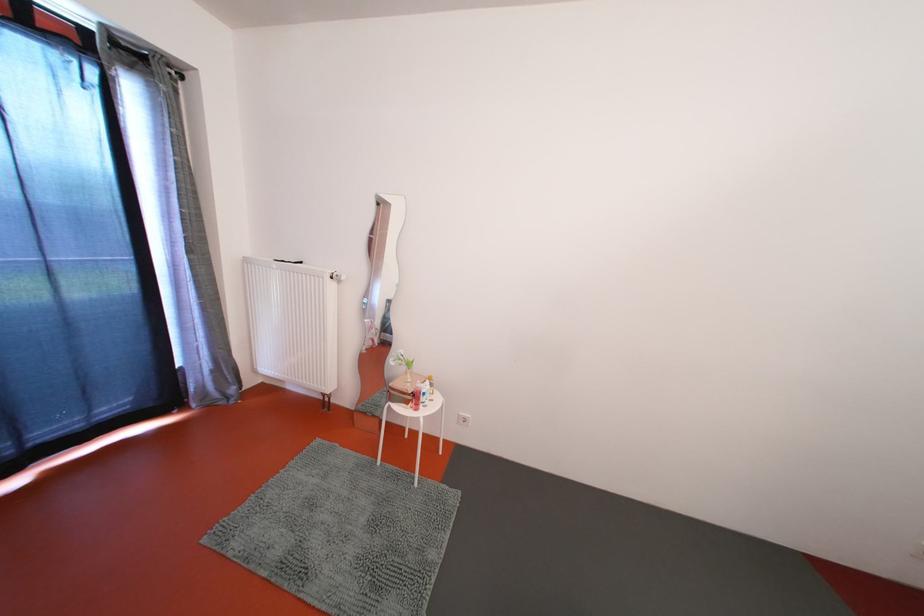
This screenshot has height=616, width=924. What do you see at coordinates (337, 277) in the screenshot?
I see `a white radiator knob` at bounding box center [337, 277].